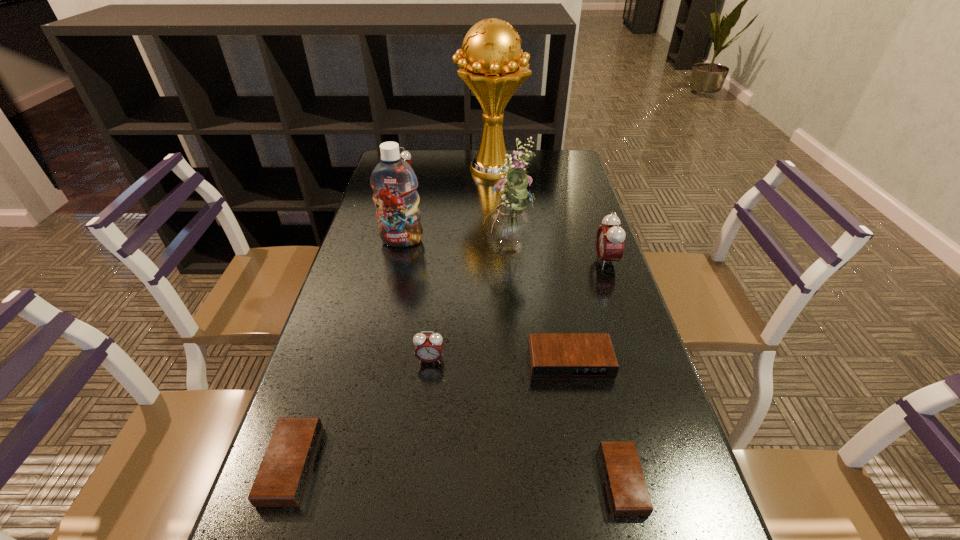
The height and width of the screenshot is (540, 960). Identify the location of vacant area situated on the front face of the leftmost black alarm clock. (456, 465).

The height and width of the screenshot is (540, 960). Find the location of `vacant position located on the front face of the shortest object`. vacant position located on the front face of the shortest object is located at coordinates (571, 481).

Where is `vacant space positioned on the front face of the shortest object`? The width and height of the screenshot is (960, 540). vacant space positioned on the front face of the shortest object is located at coordinates (468, 481).

The height and width of the screenshot is (540, 960). In order to click on vacant position located on the front face of the shortest object in this screenshot , I will do `click(548, 481)`.

The image size is (960, 540). I want to click on trophy_cup present at the far edge, so click(494, 66).

Find the location of a particular element. This screenshot has height=540, width=960. alarm clock that is positioned at the far edge is located at coordinates (405, 155).

What are the coordinates of `shampoo that is at the left edge` in the screenshot? It's located at click(x=393, y=181).

You are a GUI agent. You are given a task and a screenshot of the screen. Output one action in this format:
    pyautogui.click(x=<x>, y=<y>)
    Task: Click on the object situated at the far left corner
    
    Given the screenshot: What is the action you would take?
    pyautogui.click(x=405, y=155)

Where is `free space at the far edge of the desktop`? This screenshot has height=540, width=960. free space at the far edge of the desktop is located at coordinates (456, 165).

This screenshot has height=540, width=960. What are the coordinates of `free space at the left edge of the desktop` in the screenshot? It's located at (358, 282).